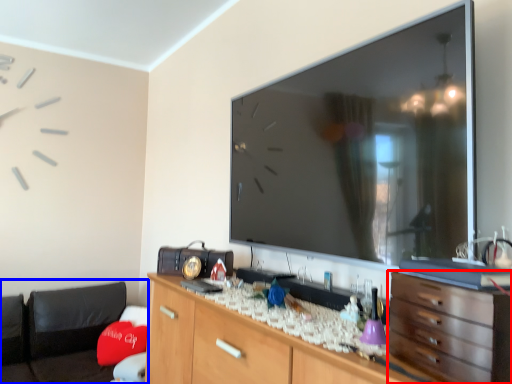
Question: Which object is further to the camera taking this photo, chest of drawers (highlighted by a red box) or bean bag chair (highlighted by a blue box)?

Choices:
 (A) chest of drawers
 (B) bean bag chair

Answer: (B)